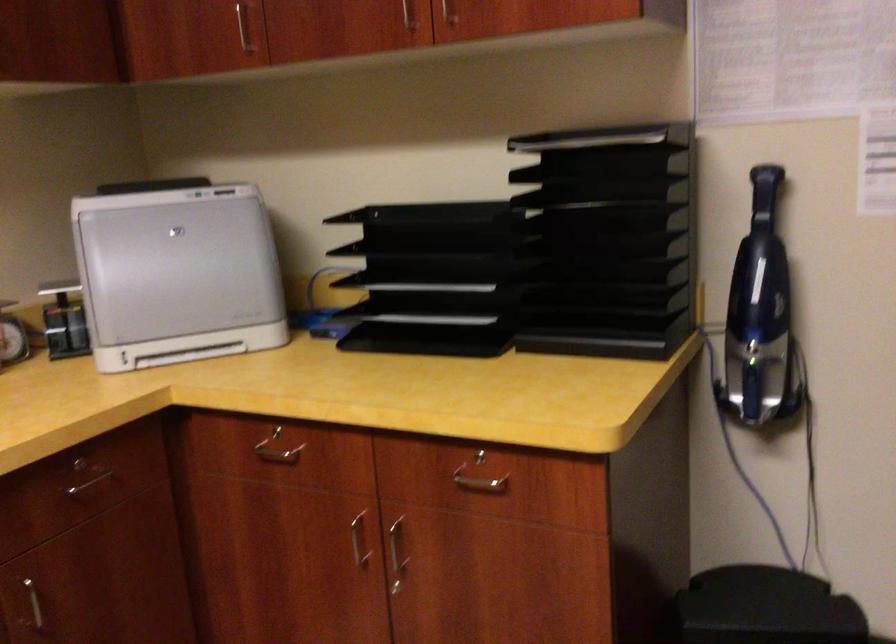
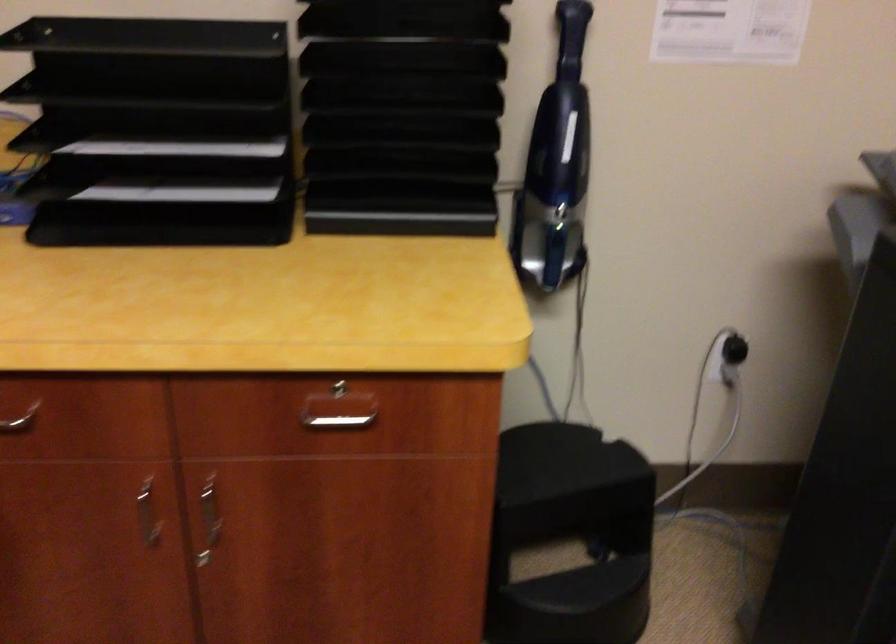
Where in the second image is the point corresponding to point 488,489 from the first image?

(338, 422)